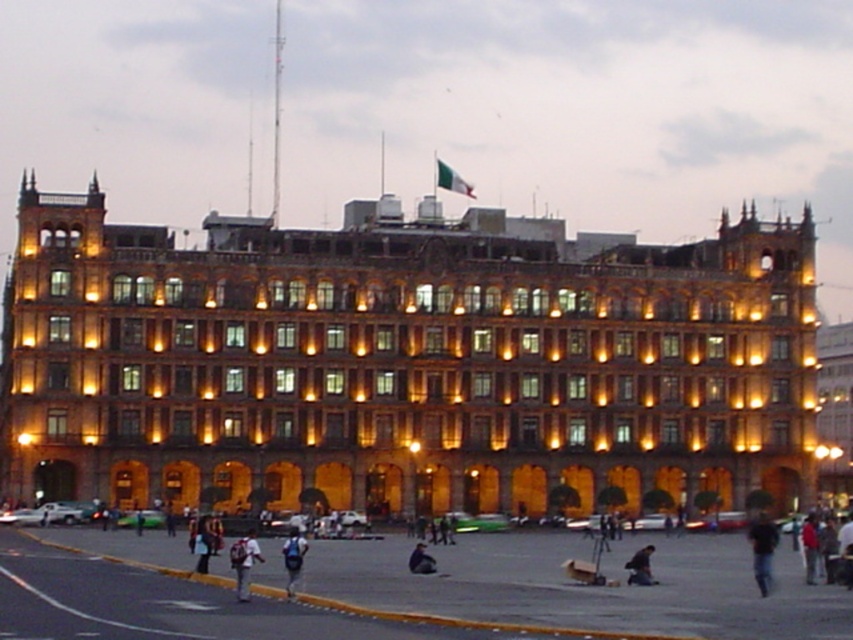
Based on the photo, you are standing on the street in front of the golden stone building at center. If you want to take a photo of the building with the flagpole at the top clearly visible, where should you position yourself relative to the building?

Since the golden stone building at center is located at point (x=402, y=362), you should position yourself directly in front of the building at that coordinate to ensure the flagpole at the top is clearly visible in your photo.

Looking at this image, you are standing at the entrance of the grand building and want to walk to the smooth asphalt road at lower left. Which direction should you head towards?

You should head towards the lower left direction to reach the smooth asphalt road at lower left as it is located at point (585, 586) on the image.